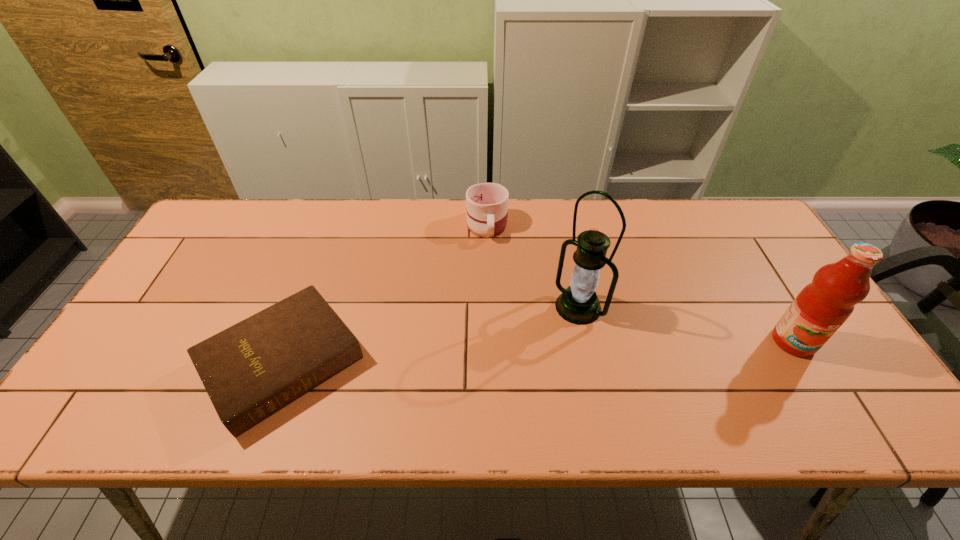
In the image, there is a desktop. In order to click on free space at the near edge in this screenshot , I will do `click(164, 387)`.

Identify the location of blank space at the left edge of the desktop. (187, 327).

In the image, there is a desktop. What are the coordinates of `free space at the right edge` in the screenshot? It's located at (782, 260).

In order to click on free space at the far left corner of the desktop in this screenshot , I will do `click(265, 200)`.

This screenshot has width=960, height=540. Find the location of `vacant region between the shortest object and the third shortest object`. vacant region between the shortest object and the third shortest object is located at coordinates (539, 353).

Identify the location of free space between the second object from left to right and the tallest object. (533, 266).

You are a GUI agent. You are given a task and a screenshot of the screen. Output one action in this format:
    pyautogui.click(x=<x>, y=<y>)
    Task: Click on the free space between the Bible and the lantern
    
    Given the screenshot: What is the action you would take?
    pyautogui.click(x=431, y=335)

Find the location of a particular element. This screenshot has width=960, height=540. vacant area that lies between the second shortest object and the fruit juice is located at coordinates (640, 283).

Where is `vacant space that's between the shortest object and the mug`? vacant space that's between the shortest object and the mug is located at coordinates (385, 294).

At what (x,y) coordinates should I click in order to perform the action: click on blank region between the third tallest object and the third object from left to right. Please return your answer as a coordinate pair (x, y). The image size is (960, 540). Looking at the image, I should click on (533, 266).